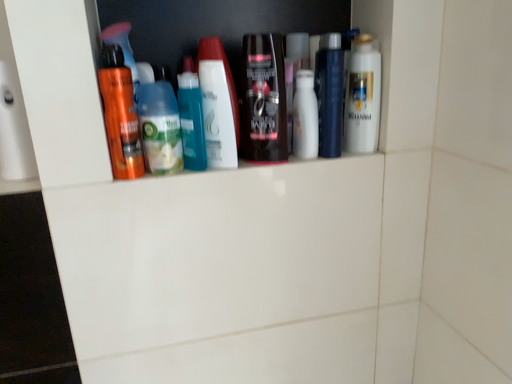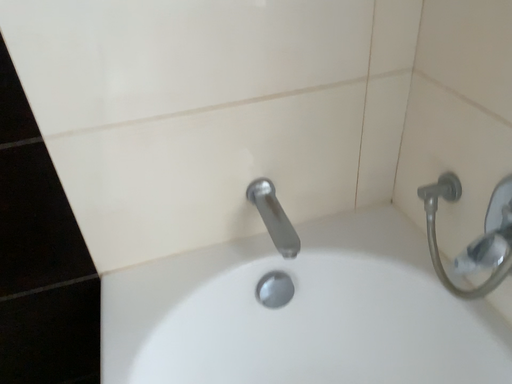
Question: Which way did the camera rotate in the video?

Choices:
 (A) rotated upward
 (B) rotated downward

Answer: (B)